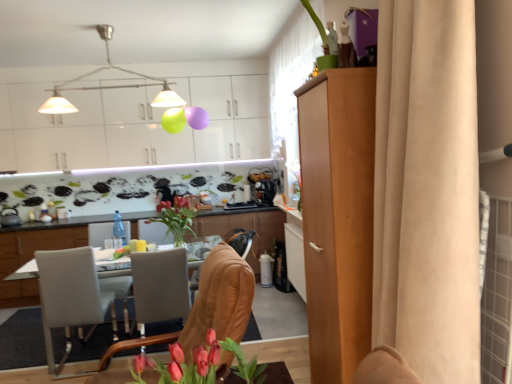
Describe the element at coordinates (33, 254) in the screenshot. The image size is (512, 384). I see `white glossy table at center, the second cabinetry positioned from the front` at that location.

This screenshot has width=512, height=384. Describe the element at coordinates (176, 218) in the screenshot. I see `vivid red flowers in glass vase at center, which ranks as the 2th floral arrangement in right-to-left order` at that location.

Locate an element on the screen. beige fabric curtain at right, the second curtain when ordered from back to front is located at coordinates (426, 189).

Consider the image. What is the approximate width of beige fabric curtain at right, the second curtain when ordered from back to front?

beige fabric curtain at right, the second curtain when ordered from back to front, is 14.09 inches wide.

How much space does smooth pink tulips at lower center, which appears as the 2th floral arrangement when viewed from the top, occupy horizontally?

smooth pink tulips at lower center, which appears as the 2th floral arrangement when viewed from the top, is 12.49 inches in width.

You are a GUI agent. You are given a task and a screenshot of the screen. Output one action in this format:
    pyautogui.click(x=<x>, y=<y>)
    Task: Click on the smooth pink tulips at lower center, the first floral arrangement viewed from the front
    This screenshot has width=512, height=384.
    Given the screenshot: What is the action you would take?
    pyautogui.click(x=199, y=364)

The height and width of the screenshot is (384, 512). What do you see at coordinates (119, 292) in the screenshot?
I see `white leather armchair at left` at bounding box center [119, 292].

Identify the location of white glossy table at center, which is the 2th cabinetry from back to front. (33, 254).

From a real-world perspective, which is physically above, white leather armchair at left or metallic pendant lights at upper center?

metallic pendant lights at upper center, from a real-world perspective.

From the picture: Is metallic pendant lights at upper center at the back of white leather armchair at left?

No, white leather armchair at left is not facing the opposite direction of metallic pendant lights at upper center.

Are white leather armchair at left and metallic pendant lights at upper center making contact?

white leather armchair at left and metallic pendant lights at upper center are not in contact.

Measure the distance from white leather armchair at left to metallic pendant lights at upper center.

They are 8.73 feet apart.

Between white glossy cabinets at upper center, placed as the first cabinetry when sorted from back to front, and beige fabric curtain at right, marked as the first curtain in a front-to-back arrangement, which one has smaller size?

beige fabric curtain at right, marked as the first curtain in a front-to-back arrangement.

Which of these two, white glossy cabinets at upper center, marked as the third cabinetry in a front-to-back arrangement, or beige fabric curtain at right, the second curtain when ordered from back to front, stands taller?

beige fabric curtain at right, the second curtain when ordered from back to front.

Is beige fabric curtain at right, the second curtain when ordered from back to front, at the back of white glossy cabinets at upper center, marked as the third cabinetry in a front-to-back arrangement?

white glossy cabinets at upper center, marked as the third cabinetry in a front-to-back arrangement, does not have its back to beige fabric curtain at right, the second curtain when ordered from back to front.

Based on the photo, from a real-world perspective, which object rests below the other?

beige fabric curtain at right, the second curtain when ordered from back to front.

Is the position of leather at center, the 2th chair in the left-to-right sequence, more distant than that of white leather armchair at left?

No, leather at center, the 2th chair in the left-to-right sequence, is in front of white leather armchair at left.

From a real-world perspective, which object stands above the other?

In real-world perspective, leather at center, the 2th chair in the left-to-right sequence, is above.

From the picture: Would you say leather at center, the 2th chair in the left-to-right sequence, is outside white leather armchair at left?

Yes, leather at center, the 2th chair in the left-to-right sequence, is located beyond the bounds of white leather armchair at left.

Based on the photo, from the image's perspective, is leather at center, the 1th chair when ordered from right to left, beneath white leather armchair at left?

Incorrect, from the image's perspective, leather at center, the 1th chair when ordered from right to left, is higher than white leather armchair at left.

Could you tell me if white glossy cabinets at upper center, marked as the third cabinetry in a front-to-back arrangement, is facing light brown wood cabinet at right, placed as the first cabinetry when sorted from front to back?

Yes, white glossy cabinets at upper center, marked as the third cabinetry in a front-to-back arrangement, faces towards light brown wood cabinet at right, placed as the first cabinetry when sorted from front to back.

From their relative heights in the image, would you say white glossy cabinets at upper center, placed as the first cabinetry when sorted from back to front, is taller or shorter than light brown wood cabinet at right, placed as the first cabinetry when sorted from front to back?

Considering their sizes, white glossy cabinets at upper center, placed as the first cabinetry when sorted from back to front, has less height than light brown wood cabinet at right, placed as the first cabinetry when sorted from front to back.

Which point is more distant from viewer, [71,98] or [360,137]?

The point [71,98] is farther.

From the image's perspective, does white glossy cabinets at upper center, marked as the third cabinetry in a front-to-back arrangement, appear lower than light brown wood cabinet at right, placed as the first cabinetry when sorted from front to back?

Actually, white glossy cabinets at upper center, marked as the third cabinetry in a front-to-back arrangement, appears above light brown wood cabinet at right, placed as the first cabinetry when sorted from front to back, in the image.

Could you measure the distance between leather at center, the 2th chair in the left-to-right sequence, and white glossy table at center, the second cabinetry positioned from the front?

They are 2.88 meters apart.

Consider the image. From the image's perspective, which object appears higher, leather at center, which is the second chair in back-to-front order, or white glossy table at center, the second cabinetry positioned from the front?

white glossy table at center, the second cabinetry positioned from the front, from the image's perspective.

Is leather at center, which is the second chair in back-to-front order, situated inside white glossy table at center, the second cabinetry positioned from the front, or outside?

leather at center, which is the second chair in back-to-front order, is spatially situated outside white glossy table at center, the second cabinetry positioned from the front.

Is leather at center, which is the second chair in back-to-front order, oriented towards white glossy table at center, which is the 2th cabinetry from back to front?

No, leather at center, which is the second chair in back-to-front order, is not oriented towards white glossy table at center, which is the 2th cabinetry from back to front.

Consider the image. Between white glossy cabinets at upper center, marked as the third cabinetry in a front-to-back arrangement, and white leather chair at lower left, placed as the 1th chair when sorted from left to right, which one is positioned behind?

Positioned behind is white glossy cabinets at upper center, marked as the third cabinetry in a front-to-back arrangement.

From the image's perspective, between white glossy cabinets at upper center, placed as the first cabinetry when sorted from back to front, and white leather chair at lower left, which is the 2th chair in front-to-back order, who is located below?

white leather chair at lower left, which is the 2th chair in front-to-back order, appears lower in the image.

Find the location of a particular element. The width and height of the screenshot is (512, 384). the 2nd chair located beneath the white glossy cabinets at upper center, marked as the third cabinetry in a front-to-back arrangement (from a real-world perspective) is located at coordinates (71, 298).

Is point (216, 87) behind point (41, 265)?

Yes, point (216, 87) is behind point (41, 265).

Is smooth pink tulips at lower center, arranged as the 2th floral arrangement when viewed from the left, inside the boundaries of white leather chair at lower left, which appears as the 2th chair when viewed from the right, or outside?

smooth pink tulips at lower center, arranged as the 2th floral arrangement when viewed from the left, is not enclosed by white leather chair at lower left, which appears as the 2th chair when viewed from the right.

Can you see smooth pink tulips at lower center, which appears as the 2th floral arrangement when viewed from the top, touching white leather chair at lower left, which is the 2th chair in front-to-back order?

No, smooth pink tulips at lower center, which appears as the 2th floral arrangement when viewed from the top, is not touching white leather chair at lower left, which is the 2th chair in front-to-back order.

In terms of height, does smooth pink tulips at lower center, arranged as the 1th floral arrangement when ordered from the bottom, look taller or shorter compared to white leather chair at lower left, placed as the 1th chair when sorted from left to right?

smooth pink tulips at lower center, arranged as the 1th floral arrangement when ordered from the bottom, is shorter than white leather chair at lower left, placed as the 1th chair when sorted from left to right.

This screenshot has height=384, width=512. Identify the location of armchair located below the metallic pendant lights at upper center (from the image's perspective). (119, 292).

Where is `the 3rd cabinetry counting from the left side of the beige fabric curtain at right, marked as the first curtain in a front-to-back arrangement`? This screenshot has width=512, height=384. the 3rd cabinetry counting from the left side of the beige fabric curtain at right, marked as the first curtain in a front-to-back arrangement is located at coordinates (133, 125).

Which object lies nearer to the anchor point transparent plastic bottle at center, white glossy desk at lower left or white leather chair at lower left, which is the 2th chair in front-to-back order?

The object closer to transparent plastic bottle at center is white glossy desk at lower left.

Looking at the image, which one is located further to white glossy table at center, which is the 2th cabinetry from back to front, vivid red flowers in glass vase at center, which ranks as the 2th floral arrangement in right-to-left order, or beige fabric curtain at right, marked as the first curtain in a front-to-back arrangement?

beige fabric curtain at right, marked as the first curtain in a front-to-back arrangement, is positioned further to the anchor white glossy table at center, which is the 2th cabinetry from back to front.

Considering their positions, is white glossy desk at lower left positioned closer to leather at center, which is the first chair in front-to-back order, than transparent plastic bottle at center?

transparent plastic bottle at center is positioned closer to the anchor leather at center, which is the first chair in front-to-back order.

Based on their spatial positions, is beige fabric curtain at right, marked as the first curtain in a front-to-back arrangement, or light brown wood cabinet at right, which is the 3th cabinetry in back-to-front order, further from white glossy table at center, which is the 2th cabinetry from back to front?

Based on the image, beige fabric curtain at right, marked as the first curtain in a front-to-back arrangement, appears to be further to white glossy table at center, which is the 2th cabinetry from back to front.

From the image, which object appears to be nearer to smooth pink tulips at lower center, which appears as the 2th floral arrangement when viewed from the top, white leather chair at lower left, placed as the 1th chair when sorted from left to right, or light brown wood cabinet at right, which is the 3th cabinetry in back-to-front order?

Based on the image, light brown wood cabinet at right, which is the 3th cabinetry in back-to-front order, appears to be nearer to smooth pink tulips at lower center, which appears as the 2th floral arrangement when viewed from the top.

Which object lies further to the anchor point beige fabric curtain at upper right, the first curtain from the back, metallic pendant lights at upper center or satin black coffee machine at center?

Among the two, metallic pendant lights at upper center is located further to beige fabric curtain at upper right, the first curtain from the back.

Looking at this image, which object lies nearer to the anchor point white glossy table at center, the second cabinetry positioned from the front, white glossy cabinets at upper center, marked as the third cabinetry in a front-to-back arrangement, or transparent plastic bottle at center?

Based on the image, transparent plastic bottle at center appears to be nearer to white glossy table at center, the second cabinetry positioned from the front.

From the picture: Estimate the real-world distances between objects in this image. Which object is closer to light brown wood cabinet at right, placed as the first cabinetry when sorted from front to back, white leather chair at lower left, the first chair from the back, or white leather armchair at left?

white leather chair at lower left, the first chair from the back.

Locate an element on the screen. The image size is (512, 384). bottle between smooth pink tulips at lower center, which is counted as the first floral arrangement, starting from the right, and white glossy cabinets at upper center, marked as the third cabinetry in a front-to-back arrangement, along the z-axis is located at coordinates (119, 228).

Where is `cabinetry between smooth pink tulips at lower center, arranged as the 2th floral arrangement when viewed from the back, and transparent plastic bottle at center in the front-back direction`? The width and height of the screenshot is (512, 384). cabinetry between smooth pink tulips at lower center, arranged as the 2th floral arrangement when viewed from the back, and transparent plastic bottle at center in the front-back direction is located at coordinates (338, 216).

You are a GUI agent. You are given a task and a screenshot of the screen. Output one action in this format:
    pyautogui.click(x=<x>, y=<y>)
    Task: Click on the light fixture between smooth pink tulips at lower center, arranged as the 2th floral arrangement when viewed from the back, and white glossy table at center, the second cabinetry positioned from the front, in the front-back direction
    
    Given the screenshot: What is the action you would take?
    pyautogui.click(x=108, y=86)

Find the location of `bottle between white leather chair at lower left, which is the 2th chair in front-to-back order, and light brown wood cabinet at right, which is the 3th cabinetry in back-to-front order, from left to right`. bottle between white leather chair at lower left, which is the 2th chair in front-to-back order, and light brown wood cabinet at right, which is the 3th cabinetry in back-to-front order, from left to right is located at coordinates (119, 228).